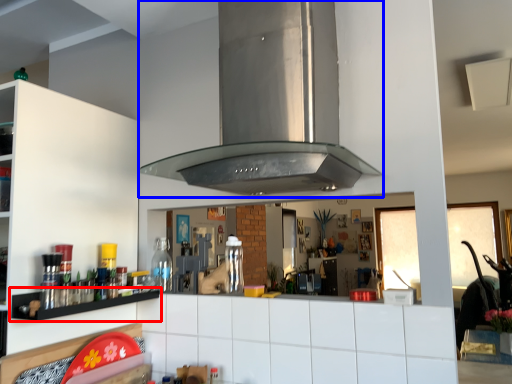
Question: Which of the following is the closest to the observer, shelf (highlighted by a red box) or vent (highlighted by a blue box)?

Choices:
 (A) shelf
 (B) vent

Answer: (B)